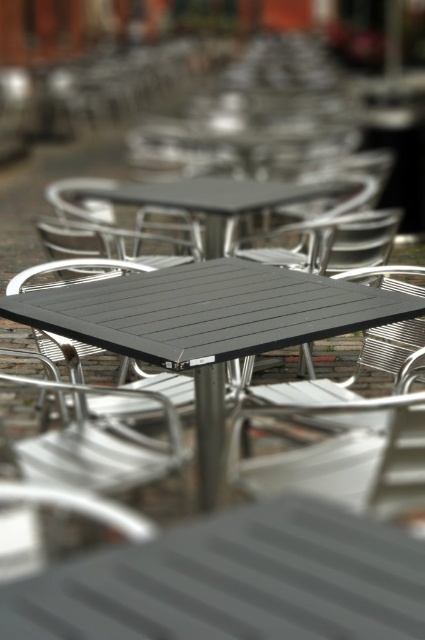
Question: Is black plastic table at center to the left of matte black table at center from the viewer's perspective?

Choices:
 (A) yes
 (B) no

Answer: (B)

Question: Which of the following is the farthest from the observer?

Choices:
 (A) (251, 326)
 (B) (85, 195)

Answer: (B)

Question: Is the position of black plastic table at center more distant than that of matte black table at center?

Choices:
 (A) no
 (B) yes

Answer: (A)

Question: Which point is farther to the camera?

Choices:
 (A) black plastic table at center
 (B) matte black table at center

Answer: (B)

Question: Can you confirm if black plastic table at center is positioned below matte black table at center?

Choices:
 (A) no
 (B) yes

Answer: (B)